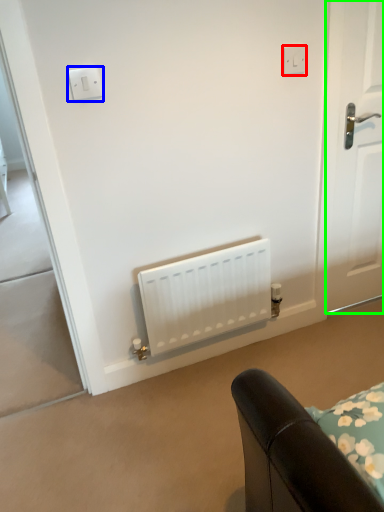
Question: Which is nearer to the electric outlet (highlighted by a red box)? light switch (highlighted by a blue box) or door (highlighted by a green box).

Choices:
 (A) light switch
 (B) door

Answer: (B)